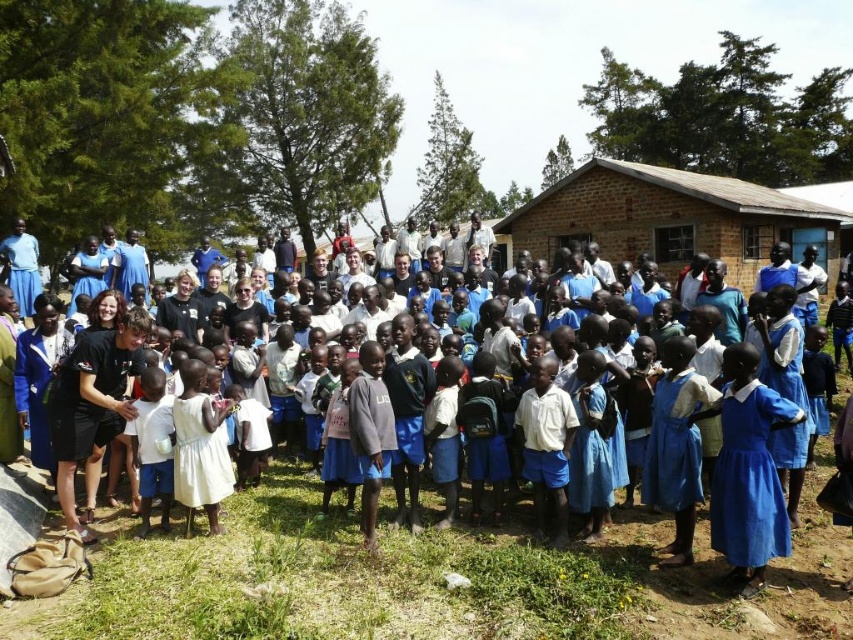
Question: Does black fabric dress at center appear on the left side of brown brick hut at center?

Choices:
 (A) no
 (B) yes

Answer: (B)

Question: Is black fabric dress at center closer to camera compared to brown brick hut at center?

Choices:
 (A) no
 (B) yes

Answer: (B)

Question: Which point is farther from the camera taking this photo?

Choices:
 (A) (566, 584)
 (B) (663, 224)
 (C) (767, 515)

Answer: (B)

Question: Which point appears closest to the camera in this image?

Choices:
 (A) (741, 496)
 (B) (262, 547)

Answer: (A)

Question: Is black fabric dress at center smaller than brown brick hut at center?

Choices:
 (A) no
 (B) yes

Answer: (B)

Question: Which of the following is the closest to the observer?

Choices:
 (A) (386, 508)
 (B) (769, 220)
 (C) (733, 406)

Answer: (C)